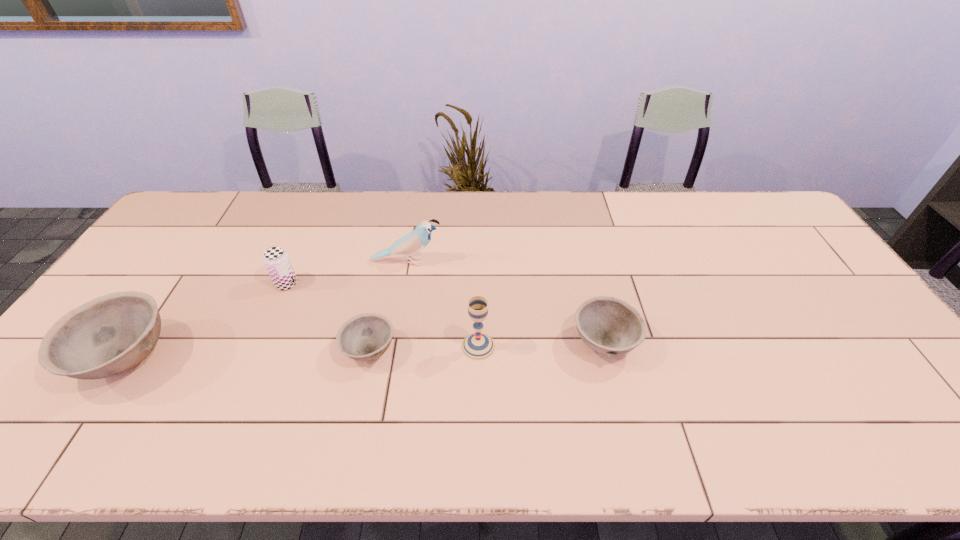
Find the location of a particular element. The height and width of the screenshot is (540, 960). free location located on the back of the leftmost bowl is located at coordinates (208, 238).

Find the location of `vacant space located 0.250m on the left of the second bowl from left to right`. vacant space located 0.250m on the left of the second bowl from left to right is located at coordinates (246, 350).

Identify the location of vacant space positioned on the left of the second shortest bowl. The image size is (960, 540). (540, 342).

I want to click on free space located at the face of the bird, so pos(514,262).

The height and width of the screenshot is (540, 960). I want to click on vacant space positioned on the back of the fifth nearest object, so click(x=321, y=205).

This screenshot has height=540, width=960. Identify the location of vacant space located on the left of the chalice. (419, 346).

Locate an element on the screen. The height and width of the screenshot is (540, 960). object at the near edge is located at coordinates (109, 335).

Where is `object that is positioned at the left edge`? The height and width of the screenshot is (540, 960). object that is positioned at the left edge is located at coordinates (109, 335).

Locate an element on the screen. The width and height of the screenshot is (960, 540). object located in the near left corner section of the desktop is located at coordinates (109, 335).

Find the location of a particular element. The height and width of the screenshot is (540, 960). free point at the far edge is located at coordinates (710, 230).